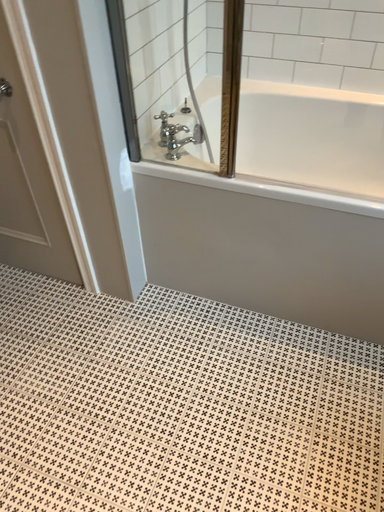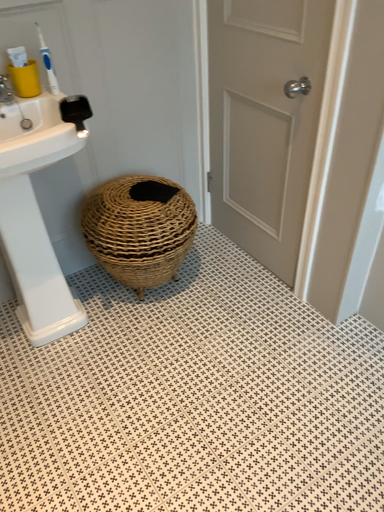
Question: How did the camera likely rotate when shooting the video?

Choices:
 (A) rotated upward
 (B) rotated downward

Answer: (A)